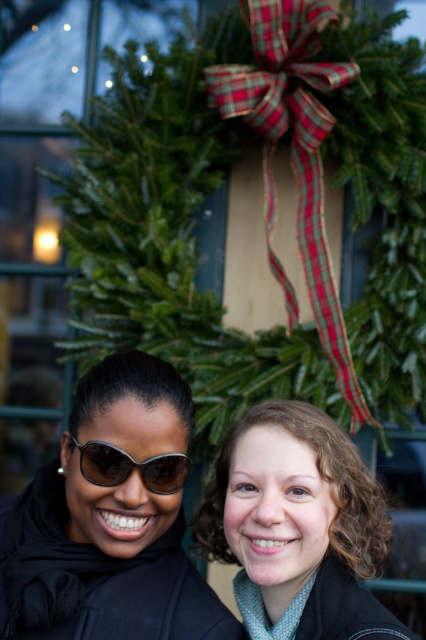
You are a photographer trying to focus on the curly brown hair at center and sunglasses at center in the image. Which of these two objects appears bigger in the photo?

The curly brown hair at center appears bigger than the sunglasses at center in the photo.

You are a photographer trying to capture a group photo of the curly brown hair at center and the other person. If your camera has a minimum focus distance of 1 meter, can you take a clear photo of both without moving them?

The curly brown hair at center and the other person are 1.24 meters apart. Since the minimum focus distance is 1 meter, the photographer can take a clear photo of both without moving them because the distance between them is greater than the minimum focus requirement.